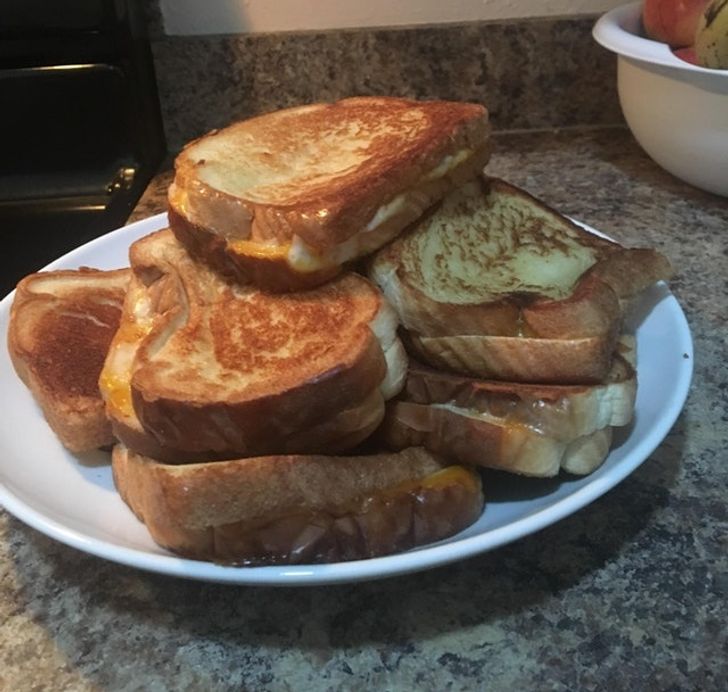
Locate an element on the screen. Image resolution: width=728 pixels, height=692 pixels. wall is located at coordinates (277, 6).